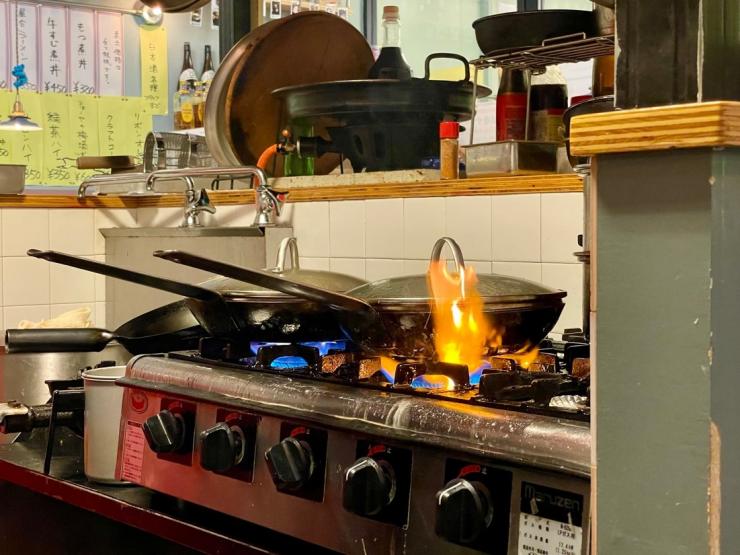
Identify the location of bottles. (186, 65), (212, 68), (396, 65).